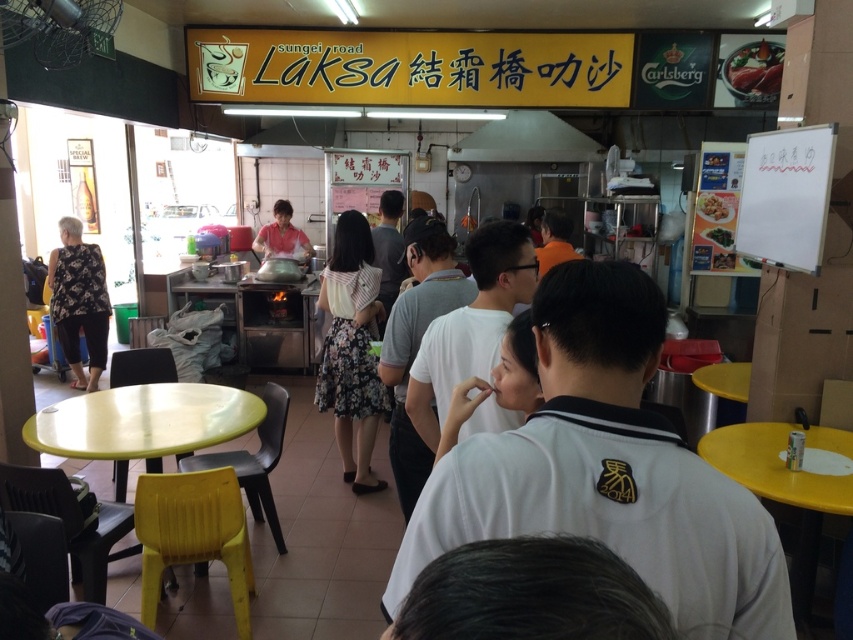
Question: Which of these objects is positioned closest to the yellow plastic table at lower left?

Choices:
 (A) matte pink shirt at center
 (B) green leafy vegetables at upper right

Answer: (B)

Question: Observing the image, what is the correct spatial positioning of yellow plastic table at lower left in reference to smooth plastic bowl at center?

Choices:
 (A) right
 (B) left

Answer: (B)

Question: Does yellow plastic table at lower right lie behind green leafy vegetables at upper right?

Choices:
 (A) no
 (B) yes

Answer: (A)

Question: Which is nearer to the yellow plastic table at lower right?

Choices:
 (A) matte pink shirt at center
 (B) white matte shirt at center
 (C) white glossy bowl at center
 (D) white shirt at center

Answer: (B)

Question: Which point is closer to the camera taking this photo?

Choices:
 (A) 840,480
 (B) 722,262

Answer: (A)

Question: Is white matte shirt at center thinner than white glossy bowl at center?

Choices:
 (A) yes
 (B) no

Answer: (B)